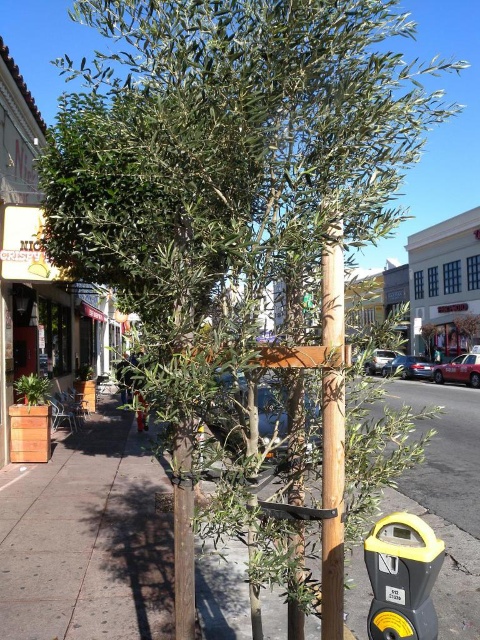
Is brown wooden pole at center further to camera compared to yellow plastic parking meter at lower right?

Yes, brown wooden pole at center is behind yellow plastic parking meter at lower right.

Can you confirm if brown wooden pole at center is positioned above yellow plastic parking meter at lower right?

Incorrect, brown wooden pole at center is not positioned above yellow plastic parking meter at lower right.

The width and height of the screenshot is (480, 640). Identify the location of brown wooden pole at center. (86, 540).

This screenshot has height=640, width=480. Find the location of `brown wooden pole at center`. brown wooden pole at center is located at coordinates (86, 540).

Is point (437, 428) in front of point (333, 577)?

That is False.

Who is more forward, (35, 570) or (322, 253)?

Point (322, 253)

Where is `brown wooden pole at center`? The height and width of the screenshot is (640, 480). brown wooden pole at center is located at coordinates (86, 540).

Can you confirm if wooden pole at center is shorter than yellow plastic parking meter at lower right?

In fact, wooden pole at center may be taller than yellow plastic parking meter at lower right.

This screenshot has height=640, width=480. Describe the element at coordinates (333, 432) in the screenshot. I see `wooden pole at center` at that location.

Does point (326, 636) come in front of point (418, 561)?

No, it is behind (418, 561).

This screenshot has height=640, width=480. Find the location of `wooden pole at center`. wooden pole at center is located at coordinates (333, 432).